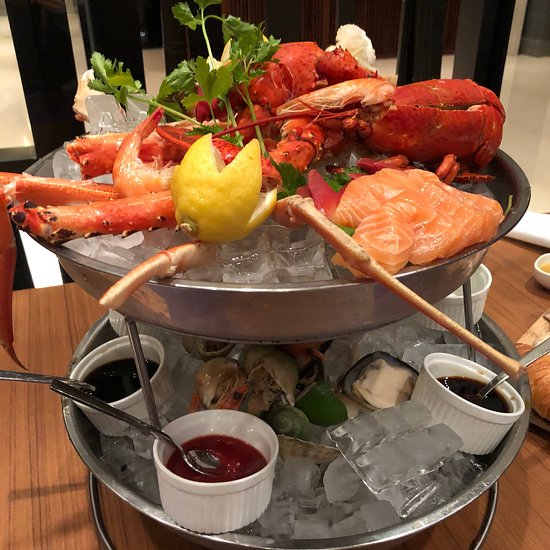
Identify the location of spoons. This screenshot has width=550, height=550. (117, 412), (25, 378), (538, 352).